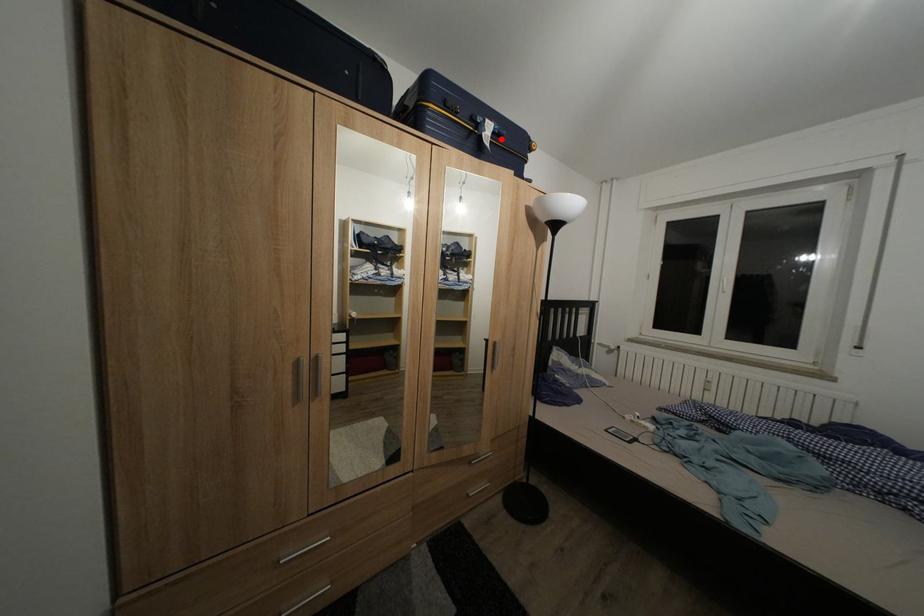
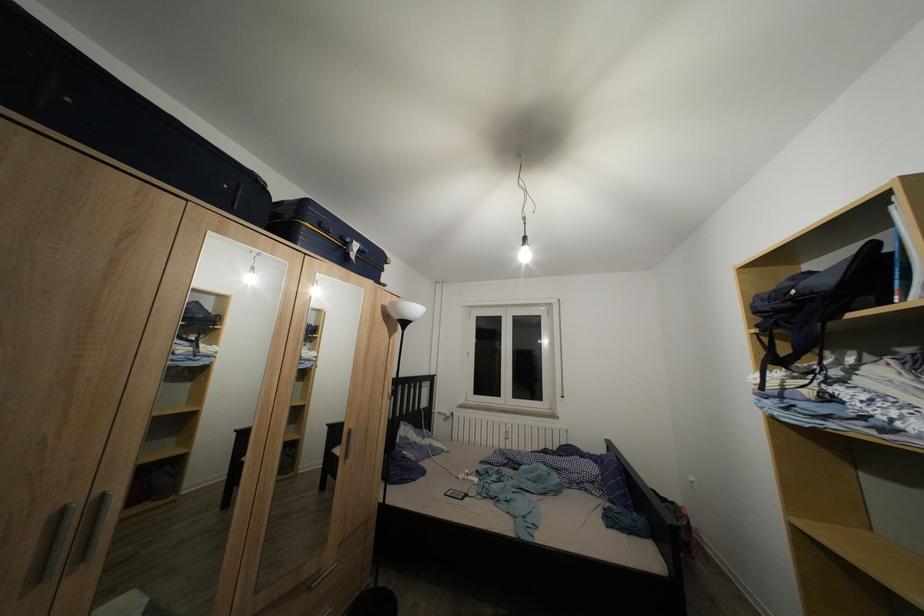
Locate, in the second image, the point that corresponds to the highlighted location in the first image.

(367, 257)